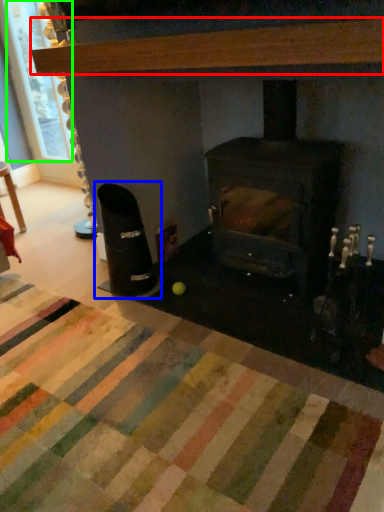
Question: Which object is positioned closest to hardwood (highlighted by a red box)? Select from armchair (highlighted by a blue box) and window screen (highlighted by a green box).

Choices:
 (A) armchair
 (B) window screen

Answer: (A)